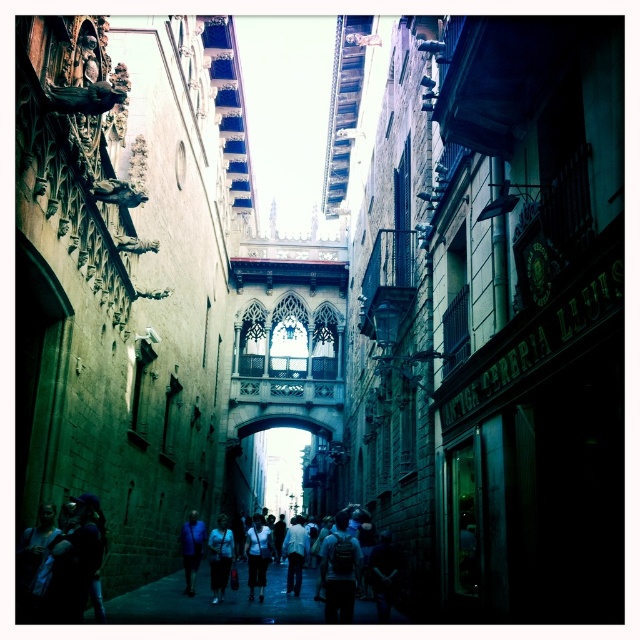
Who is positioned more to the right, transparent glass archway at center or dark blue jeans at center?

dark blue jeans at center is more to the right.

Can you confirm if transparent glass archway at center is smaller than dark blue jeans at center?

Actually, transparent glass archway at center might be larger than dark blue jeans at center.

What do you see at coordinates (285, 465) in the screenshot? The image size is (640, 640). I see `transparent glass archway at center` at bounding box center [285, 465].

Image resolution: width=640 pixels, height=640 pixels. What are the coordinates of `transparent glass archway at center` in the screenshot? It's located at pos(285,465).

Does matte white shirt at center have a lesser width compared to white matte shirt at center?

No.

Can you confirm if matte white shirt at center is bigger than white matte shirt at center?

Yes.

Between point (228, 560) and point (300, 544), which one is positioned in front?

Positioned in front is point (228, 560).

The image size is (640, 640). I want to click on matte white shirt at center, so click(x=220, y=557).

Is transparent glass archway at center wider than matte white shirt at center?

Correct, the width of transparent glass archway at center exceeds that of matte white shirt at center.

The width and height of the screenshot is (640, 640). What do you see at coordinates (285, 465) in the screenshot?
I see `transparent glass archway at center` at bounding box center [285, 465].

Where is `transparent glass archway at center`? This screenshot has height=640, width=640. transparent glass archway at center is located at coordinates (285, 465).

What are the coordinates of `transparent glass archway at center` in the screenshot? It's located at (285, 465).